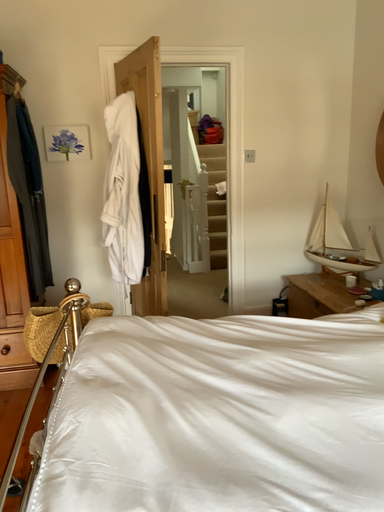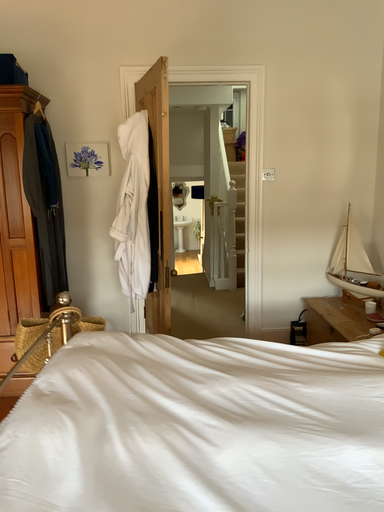
Question: How did the camera likely rotate when shooting the video?

Choices:
 (A) rotated right
 (B) rotated left

Answer: (B)